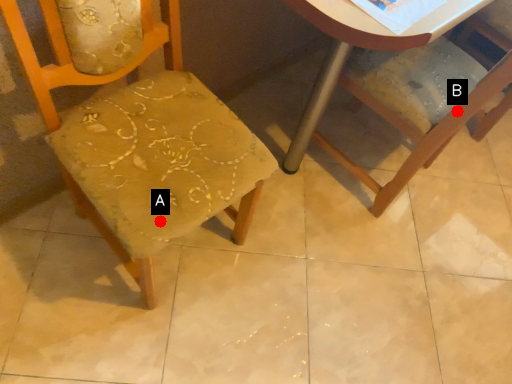
Question: Two points are circled on the image, labeled by A and B beside each circle. Which point appears farthest from the camera in this image?

Choices:
 (A) A is further
 (B) B is further

Answer: (B)